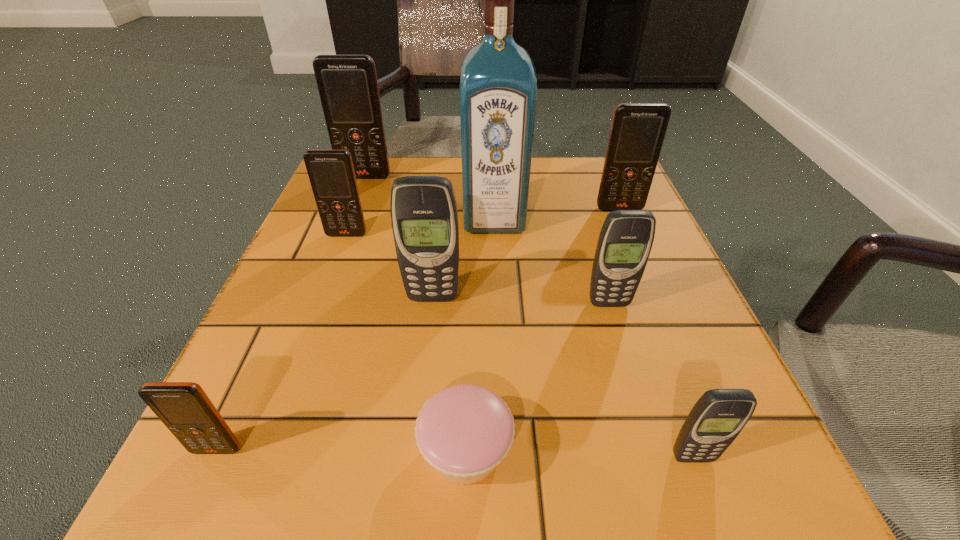
The image size is (960, 540). I want to click on vacant space at the right edge of the desktop, so click(x=679, y=292).

Find the location of `vacant region at the far left corner of the desktop`. vacant region at the far left corner of the desktop is located at coordinates (392, 169).

Locate an element on the screen. blank space at the near left corner of the desktop is located at coordinates (289, 519).

Identify the location of vacant space at the far right corner. The width and height of the screenshot is (960, 540). (569, 177).

The width and height of the screenshot is (960, 540). In the image, there is a desktop. In order to click on vacant space at the near right corner in this screenshot , I will do `click(764, 444)`.

Where is `free area in between the second smallest gray cellular telephone and the tallest cellular telephone`? This screenshot has width=960, height=540. free area in between the second smallest gray cellular telephone and the tallest cellular telephone is located at coordinates (487, 240).

Locate an element on the screen. This screenshot has height=540, width=960. vacant space in between the second smallest gray cellular telephone and the nearest gray cellular telephone is located at coordinates (651, 380).

This screenshot has height=540, width=960. Find the location of `vacant area that lies between the second smallest gray cellular telephone and the farthest orange cellular telephone`. vacant area that lies between the second smallest gray cellular telephone and the farthest orange cellular telephone is located at coordinates pos(487,240).

The height and width of the screenshot is (540, 960). Identify the location of vacant area that lies between the cupcake and the farthest object. coord(416,314).

Locate an element on the screen. vacant region between the biggest orange cellular telephone and the nearest gray cellular telephone is located at coordinates (529, 317).